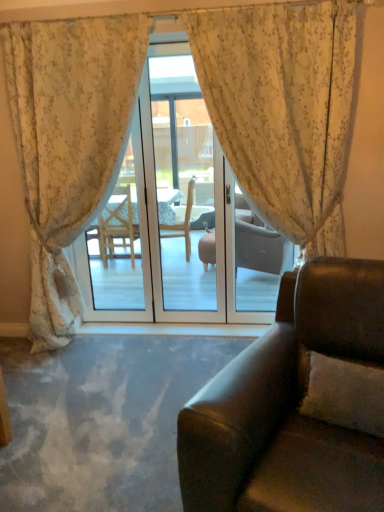
Question: In the image, is floral fabric curtain at center, placed as the first curtain when sorted from left to right, positioned in front of or behind transparent glass door at center?

Choices:
 (A) behind
 (B) front

Answer: (B)

Question: Is floral fabric curtain at center, placed as the first curtain when sorted from left to right, wider or thinner than transparent glass door at center?

Choices:
 (A) wide
 (B) thin

Answer: (A)

Question: Which object is the farthest from the transparent glass door at center?

Choices:
 (A) white textured pillow at lower right
 (B) floral fabric curtain at center, which is the second curtain in right-to-left order
 (C) leather couch at lower right
 (D) floral sheer curtain at center, which is the 1th curtain in right-to-left order

Answer: (A)

Question: Which of these objects is positioned closest to the floral fabric curtain at center, which is the second curtain in right-to-left order?

Choices:
 (A) floral sheer curtain at center, which is the 1th curtain in right-to-left order
 (B) transparent glass door at center
 (C) white textured pillow at lower right
 (D) leather couch at lower right

Answer: (A)